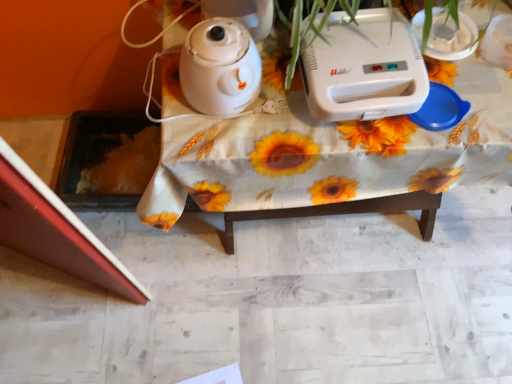
Question: From the image's perspective, is white plastic table at center above or below white plastic toaster at upper center?

Choices:
 (A) above
 (B) below

Answer: (B)

Question: From a real-world perspective, is white plastic table at center above or below white plastic toaster at upper center?

Choices:
 (A) below
 (B) above

Answer: (A)

Question: Which of these objects is positioned closest to the white plastic table at center?

Choices:
 (A) white glossy kettle at upper center
 (B) white plastic toaster at upper center

Answer: (B)

Question: Which of these objects is positioned farthest from the white glossy kettle at upper center?

Choices:
 (A) white plastic toaster at upper center
 (B) white plastic table at center

Answer: (A)